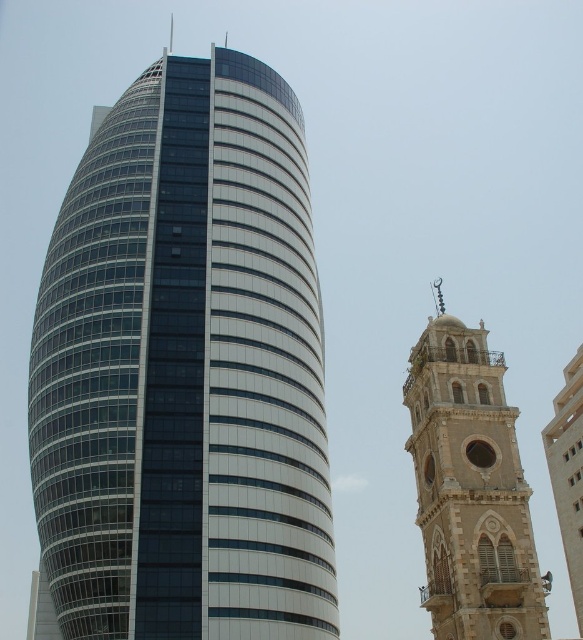
Question: Which point is farther to the camera?

Choices:
 (A) glassy steel tower at center
 (B) stone tower at right

Answer: (B)

Question: Is glassy steel tower at center behind stone tower at right?

Choices:
 (A) no
 (B) yes

Answer: (A)

Question: Is glassy steel tower at center positioned before stone tower at right?

Choices:
 (A) no
 (B) yes

Answer: (B)

Question: Which of the following is the closest to the observer?

Choices:
 (A) (236, 328)
 (B) (518, 632)

Answer: (B)

Question: Considering the relative positions of glassy steel tower at center and stone tower at right in the image provided, where is glassy steel tower at center located with respect to stone tower at right?

Choices:
 (A) left
 (B) right

Answer: (A)

Question: Among these objects, which one is farthest from the camera?

Choices:
 (A) stone tower at right
 (B) glassy steel tower at center

Answer: (A)